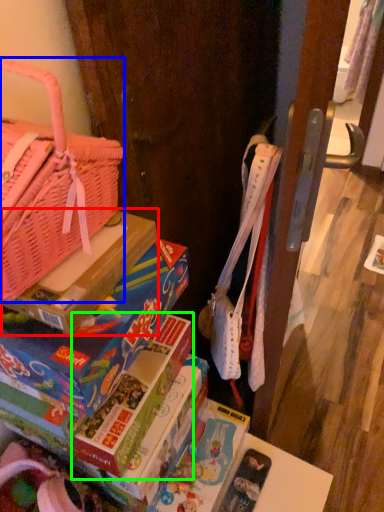
Question: Which object is positioned closest to cardboard box (highlighted by a red box)? Select from handbag (highlighted by a blue box) and paperback book (highlighted by a green box).

Choices:
 (A) handbag
 (B) paperback book

Answer: (A)